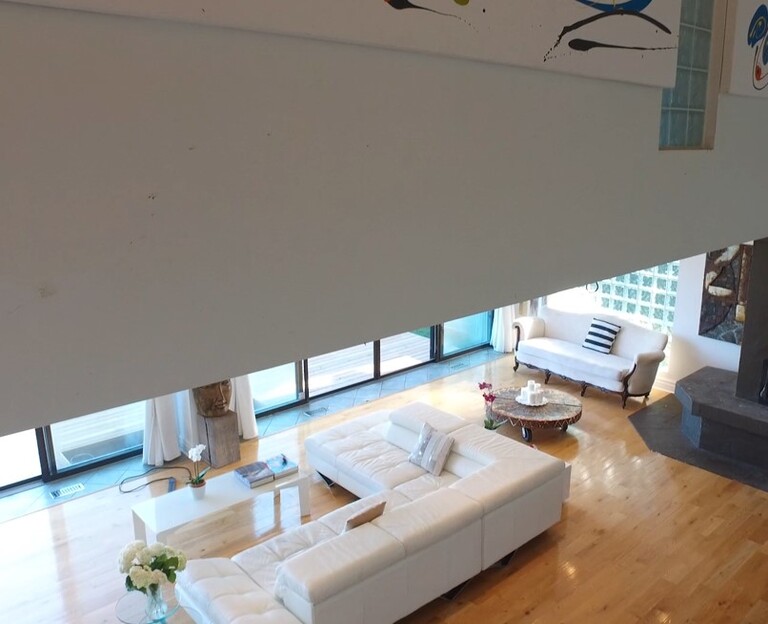
The width and height of the screenshot is (768, 624). I want to click on hardwood floor, so click(x=657, y=510).